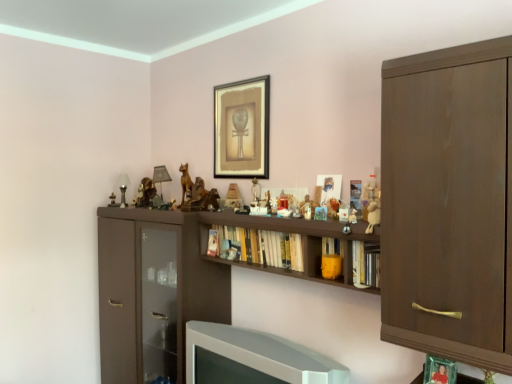
Question: Considering the positions of matte wooden figurine at center, which ranks as the third toy in right-to-left order, and metallic figurine at left, which is the first toy from back to front, in the image, is matte wooden figurine at center, which ranks as the third toy in right-to-left order, wider or thinner than metallic figurine at left, which is the first toy from back to front,?

Choices:
 (A) wide
 (B) thin

Answer: (B)

Question: Does point (304, 205) appear closer or farther from the camera than point (112, 195)?

Choices:
 (A) farther
 (B) closer

Answer: (B)

Question: Based on their relative distances, which object is nearer to the dark brown wood cabinet at right?

Choices:
 (A) metallic figurine at left, which is the first toy from back to front
 (B) bronze statue at center
 (C) yellow matte bookshelf at center, which is counted as the 2th book, starting from the left
 (D) white glossy television at lower center
 (E) matte black picture frame at upper center

Answer: (C)

Question: Estimate the real-world distances between objects in this image. Which object is farther from the hardcover books at center, the 3th book positioned from the right?

Choices:
 (A) metallic figurine at left, which is the fourth toy in right-to-left order
 (B) dark brown wood cabinet at right
 (C) hardcover book at center, which is counted as the 3th book, starting from the back
 (D) bronze statue at center
 (E) wooden figurine at center, placed as the 3th toy when sorted from back to front

Answer: (A)